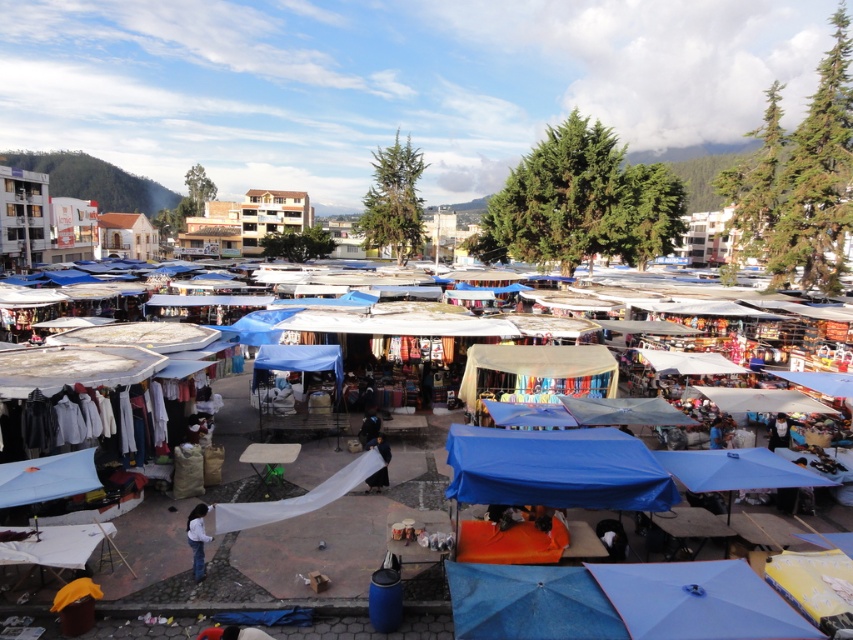
Can you confirm if white fabric at lower left is shorter than smooth skin face at center?

No.

This screenshot has width=853, height=640. Identify the location of white fabric at lower left. (196, 538).

Where is `white fabric at lower left`? This screenshot has width=853, height=640. white fabric at lower left is located at coordinates (196, 538).

Who is lower down, white fabric at center or dark blue fabric at center?

Positioned lower is white fabric at center.

Can you confirm if white fabric at center is bigger than dark blue fabric at center?

Yes.

Is point (383, 531) farther from camera compared to point (368, 412)?

No, (383, 531) is in front of (368, 412).

At what (x,y) coordinates should I click in order to perform the action: click on white fabric at center. Please return your answer as a coordinate pair (x, y). The image size is (853, 640). Looking at the image, I should click on (276, 524).

Does white fabric at center appear under white fabric at lower left?

No, white fabric at center is not below white fabric at lower left.

Which is more to the left, white fabric at center or white fabric at lower left?

Positioned to the left is white fabric at lower left.

Describe the element at coordinates (276, 524) in the screenshot. Image resolution: width=853 pixels, height=640 pixels. I see `white fabric at center` at that location.

This screenshot has width=853, height=640. I want to click on white fabric at center, so click(x=276, y=524).